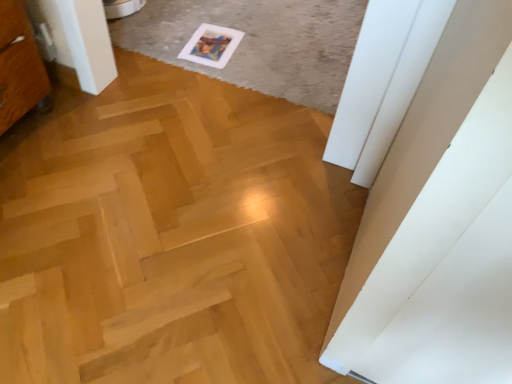
Question: Is point (192, 48) positioned closer to the camera than point (304, 13)?

Choices:
 (A) closer
 (B) farther

Answer: (A)

Question: From their relative heights in the image, would you say white paper postcard at upper center is taller or shorter than white paper at upper center?

Choices:
 (A) short
 (B) tall

Answer: (A)

Question: Based on their relative distances, which object is nearer to the natural wood plywood at center?

Choices:
 (A) white paper postcard at upper center
 (B) white paper at upper center

Answer: (B)

Question: Which object is positioned farthest from the white paper postcard at upper center?

Choices:
 (A) white paper at upper center
 (B) natural wood plywood at center

Answer: (B)